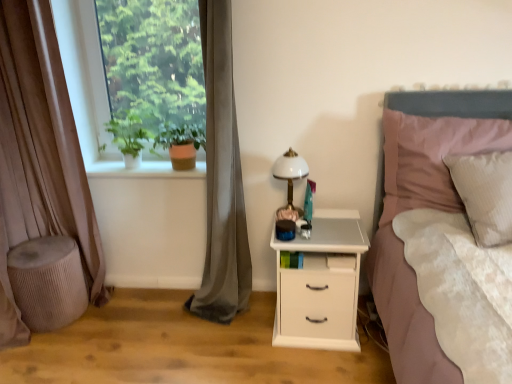
At what (x,y) coordinates should I click in order to perform the action: click on free space in front of gray velvet curtain at left, the first curtain in the right-to-left sequence. Please return your answer as a coordinate pair (x, y). Looking at the image, I should click on (215, 342).